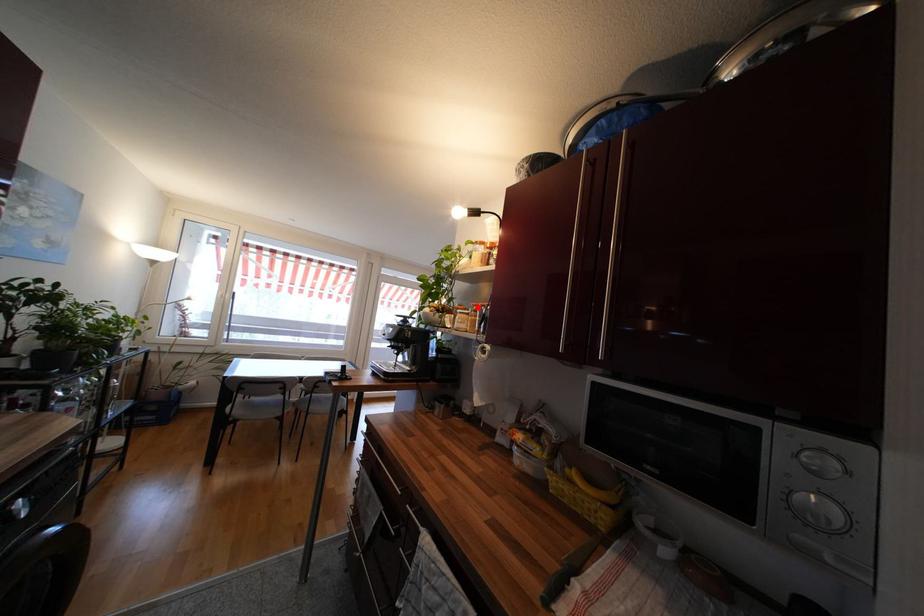
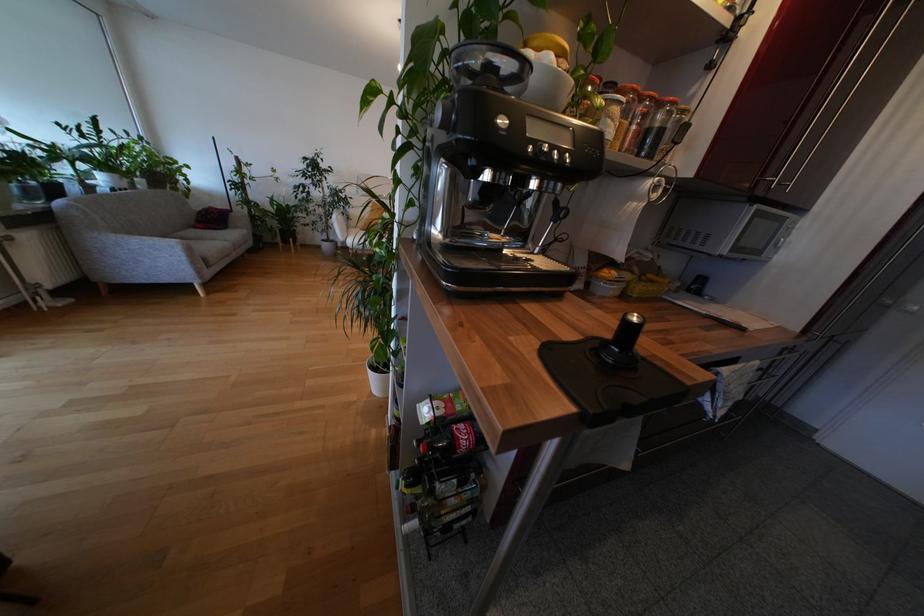
In the second image, find the point that corresponds to the highlighted location in the first image.

(636, 92)